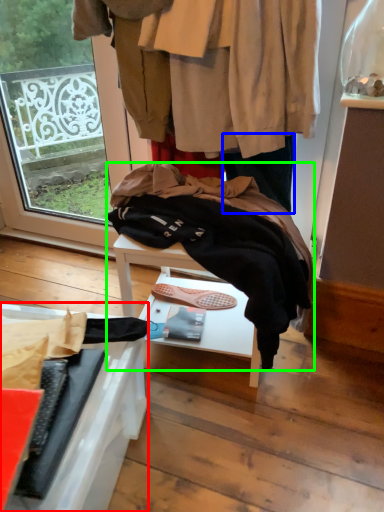
Question: Which is farther away from furniture (highlighted by a red box)? trousers (highlighted by a blue box) or wool (highlighted by a green box)?

Choices:
 (A) trousers
 (B) wool

Answer: (A)